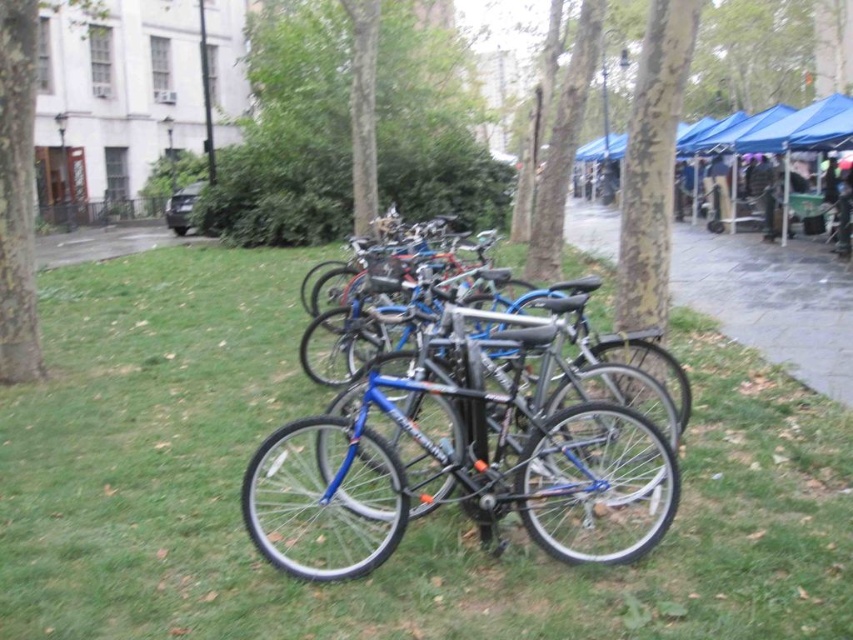
Question: Is green leafy tree at center to the left of gray concrete pavement at center from the viewer's perspective?

Choices:
 (A) no
 (B) yes

Answer: (B)

Question: Can you confirm if green grass at center is thinner than gray concrete pavement at center?

Choices:
 (A) no
 (B) yes

Answer: (A)

Question: Among these objects, which one is farthest from the camera?

Choices:
 (A) smooth bark tree at upper center
 (B) smooth bark tree at center
 (C) green grass at center
 (D) green leafy tree at center

Answer: (D)

Question: From the image, what is the correct spatial relationship of gray concrete pavement at center in relation to smooth bark tree at upper center?

Choices:
 (A) right
 (B) left

Answer: (A)

Question: Which point is closer to the camera?

Choices:
 (A) gray concrete pavement at center
 (B) brown rough tree at upper left
 (C) green leafy tree at center
 (D) green grass at center

Answer: (D)

Question: Which object is closer to the camera taking this photo?

Choices:
 (A) brown rough tree at upper left
 (B) blue metallic bicycle at center

Answer: (B)